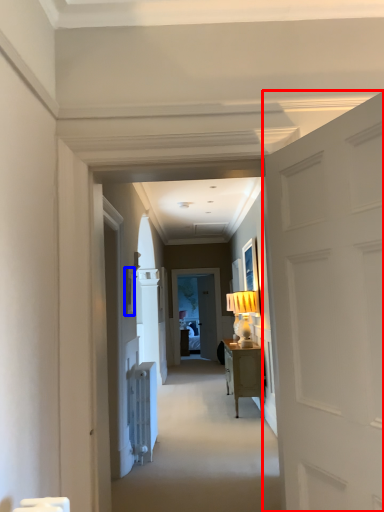
Question: Which point is closer to the camera, door (highlighted by a red box) or picture frame (highlighted by a blue box)?

Choices:
 (A) door
 (B) picture frame

Answer: (A)